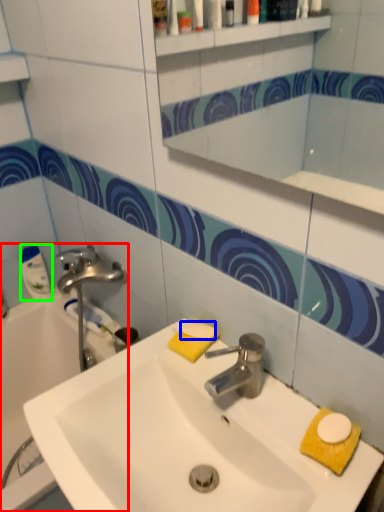
Question: Considering the real-world distances, which object is farthest from bathtub (highlighted by a red box)? soap (highlighted by a blue box) or cleaning product (highlighted by a green box)?

Choices:
 (A) soap
 (B) cleaning product

Answer: (A)